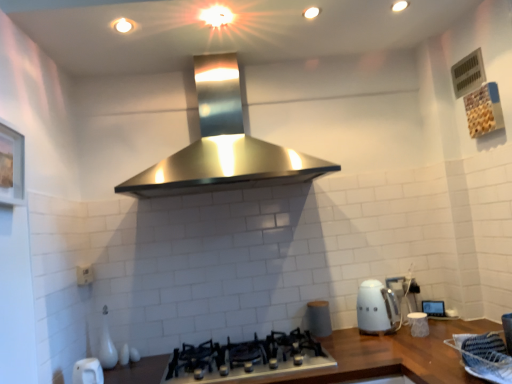
Question: Can you confirm if white glossy kettle at lower right is bigger than satin black gas stove at center?

Choices:
 (A) no
 (B) yes

Answer: (A)

Question: Is the depth of white glossy kettle at lower right greater than that of satin black gas stove at center?

Choices:
 (A) yes
 (B) no

Answer: (A)

Question: Can we say white glossy kettle at lower right lies outside satin black gas stove at center?

Choices:
 (A) yes
 (B) no

Answer: (A)

Question: Does white glossy kettle at lower right turn towards satin black gas stove at center?

Choices:
 (A) yes
 (B) no

Answer: (B)

Question: From a real-world perspective, does white glossy kettle at lower right stand above satin black gas stove at center?

Choices:
 (A) no
 (B) yes

Answer: (B)

Question: From the image's perspective, is white glossy kettle at lower right beneath satin black gas stove at center?

Choices:
 (A) no
 (B) yes

Answer: (A)

Question: Is white plastic electric outlet at lower left thinner than matte gray canister at center?

Choices:
 (A) no
 (B) yes

Answer: (B)

Question: From a real-world perspective, is white plastic electric outlet at lower left positioned under matte gray canister at center based on gravity?

Choices:
 (A) no
 (B) yes

Answer: (A)

Question: Is white plastic electric outlet at lower left completely or partially outside of matte gray canister at center?

Choices:
 (A) yes
 (B) no

Answer: (A)

Question: From the image's perspective, is white plastic electric outlet at lower left below matte gray canister at center?

Choices:
 (A) yes
 (B) no

Answer: (B)

Question: Considering the relative sizes of white plastic electric outlet at lower left and matte gray canister at center in the image provided, is white plastic electric outlet at lower left bigger than matte gray canister at center?

Choices:
 (A) no
 (B) yes

Answer: (A)

Question: Does white plastic electric outlet at lower left appear on the right side of matte gray canister at center?

Choices:
 (A) no
 (B) yes

Answer: (A)

Question: Is white glossy kettle at lower right positioned before matte gray canister at center?

Choices:
 (A) no
 (B) yes

Answer: (B)